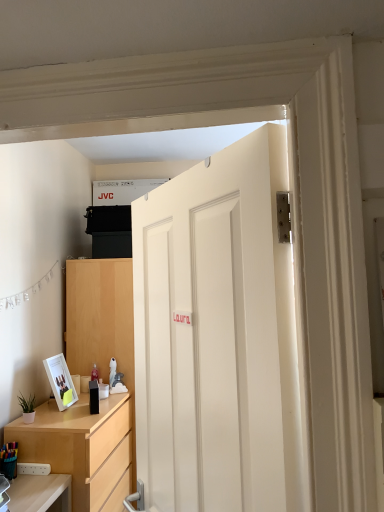
Question: Considering the relative sizes of light wood/texture dresser at lower left and multicolored plastic pen holder at lower left in the image provided, is light wood/texture dresser at lower left taller than multicolored plastic pen holder at lower left?

Choices:
 (A) yes
 (B) no

Answer: (A)

Question: Does light wood/texture dresser at lower left have a smaller size compared to multicolored plastic pen holder at lower left?

Choices:
 (A) no
 (B) yes

Answer: (A)

Question: Does light wood/texture dresser at lower left turn towards multicolored plastic pen holder at lower left?

Choices:
 (A) yes
 (B) no

Answer: (B)

Question: Is light wood/texture dresser at lower left bigger than multicolored plastic pen holder at lower left?

Choices:
 (A) no
 (B) yes

Answer: (B)

Question: Is light wood/texture dresser at lower left thinner than multicolored plastic pen holder at lower left?

Choices:
 (A) yes
 (B) no

Answer: (B)

Question: From the image's perspective, is light wood/texture dresser at lower left above or below white glossy picture frame at lower left?

Choices:
 (A) below
 (B) above

Answer: (A)

Question: Choose the correct answer: Is light wood/texture dresser at lower left inside white glossy picture frame at lower left or outside it?

Choices:
 (A) outside
 (B) inside

Answer: (A)

Question: Based on their positions, is light wood/texture dresser at lower left located to the left or right of white glossy picture frame at lower left?

Choices:
 (A) left
 (B) right

Answer: (B)

Question: Does point (8, 433) appear closer or farther from the camera than point (48, 372)?

Choices:
 (A) farther
 (B) closer

Answer: (B)

Question: Is white glossy picture frame at lower left wider or thinner than multicolored plastic pen holder at lower left?

Choices:
 (A) wide
 (B) thin

Answer: (A)

Question: Is white glossy picture frame at lower left inside or outside of multicolored plastic pen holder at lower left?

Choices:
 (A) inside
 (B) outside

Answer: (B)

Question: In terms of height, does white glossy picture frame at lower left look taller or shorter compared to multicolored plastic pen holder at lower left?

Choices:
 (A) tall
 (B) short

Answer: (A)

Question: From the image's perspective, is white glossy picture frame at lower left positioned above or below multicolored plastic pen holder at lower left?

Choices:
 (A) above
 (B) below

Answer: (A)

Question: From a real-world perspective, is multicolored plastic pen holder at lower left physically located above or below green matte plant at lower left?

Choices:
 (A) below
 (B) above

Answer: (A)

Question: Relative to green matte plant at lower left, is multicolored plastic pen holder at lower left in front or behind?

Choices:
 (A) front
 (B) behind

Answer: (A)